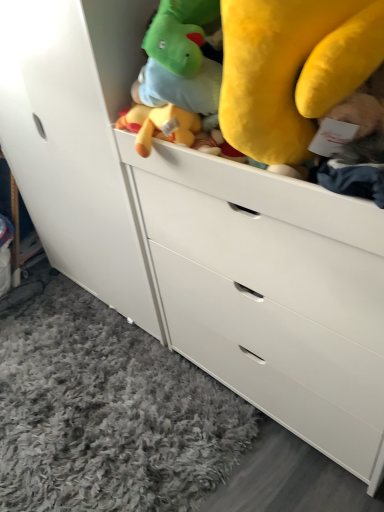
Locate an element on the screen. The height and width of the screenshot is (512, 384). gray shag rug at lower left is located at coordinates (105, 410).

What do you see at coordinates (105, 410) in the screenshot? I see `gray shag rug at lower left` at bounding box center [105, 410].

Image resolution: width=384 pixels, height=512 pixels. Find the location of `white matte cabinet at upper center`. white matte cabinet at upper center is located at coordinates (77, 140).

Measure the distance between white matte cabinet at upper center and camera.

The distance of white matte cabinet at upper center from camera is 39.32 inches.

This screenshot has height=512, width=384. Describe the element at coordinates (77, 140) in the screenshot. I see `white matte cabinet at upper center` at that location.

The image size is (384, 512). Identify the location of gray shag rug at lower left. (105, 410).

From the picture: Between gray shag rug at lower left and white matte cabinet at upper center, which one appears on the right side from the viewer's perspective?

white matte cabinet at upper center is more to the right.

Is gray shag rug at lower left positioned before white matte cabinet at upper center?

No.

Considering the points (118, 412) and (108, 222), which point is behind, point (118, 412) or point (108, 222)?

The point (108, 222) is more distant.

From the image's perspective, relative to white matte cabinet at upper center, is gray shag rug at lower left above or below?

Based on their image positions, gray shag rug at lower left is located beneath white matte cabinet at upper center.

From a real-world perspective, relative to white matte cabinet at upper center, is gray shag rug at lower left vertically above or below?

Answer: In terms of real-world spatial position, gray shag rug at lower left is below white matte cabinet at upper center.

Considering the sizes of objects gray shag rug at lower left and white matte cabinet at upper center in the image provided, who is wider, gray shag rug at lower left or white matte cabinet at upper center?

With larger width is gray shag rug at lower left.

Based on the photo, considering the sizes of objects gray shag rug at lower left and white matte cabinet at upper center in the image provided, who is taller, gray shag rug at lower left or white matte cabinet at upper center?

Standing taller between the two is white matte cabinet at upper center.

Who is bigger, gray shag rug at lower left or white matte cabinet at upper center?

white matte cabinet at upper center.

Is gray shag rug at lower left situated inside white matte cabinet at upper center or outside?

The correct answer is: outside.

Are gray shag rug at lower left and white matte cabinet at upper center located far from each other?

No, gray shag rug at lower left is in close proximity to white matte cabinet at upper center.

Based on the photo, is white matte cabinet at upper center at the back of gray shag rug at lower left?

No, white matte cabinet at upper center is not at the back of gray shag rug at lower left.

Where is `cabinetry that is on the right side of gray shag rug at lower left`? This screenshot has height=512, width=384. cabinetry that is on the right side of gray shag rug at lower left is located at coordinates 77,140.

Considering the positions of objects white matte cabinet at upper center and gray shag rug at lower left in the image provided, who is more to the left, white matte cabinet at upper center or gray shag rug at lower left?

gray shag rug at lower left.

Does white matte cabinet at upper center come behind gray shag rug at lower left?

No, white matte cabinet at upper center is in front of gray shag rug at lower left.

Considering the points (52, 238) and (113, 373), which point is in front, point (52, 238) or point (113, 373)?

The point (113, 373) is more forward.

From the image's perspective, is white matte cabinet at upper center beneath gray shag rug at lower left?

Incorrect, from the image's perspective, white matte cabinet at upper center is higher than gray shag rug at lower left.

From a real-world perspective, is white matte cabinet at upper center on top of gray shag rug at lower left?

Yes, from a real-world perspective, white matte cabinet at upper center is over gray shag rug at lower left

Between white matte cabinet at upper center and gray shag rug at lower left, which one has smaller width?

With smaller width is white matte cabinet at upper center.

Based on the photo, considering the sizes of objects white matte cabinet at upper center and gray shag rug at lower left in the image provided, who is taller, white matte cabinet at upper center or gray shag rug at lower left?

white matte cabinet at upper center.

Looking at this image, who is bigger, white matte cabinet at upper center or gray shag rug at lower left?

Bigger between the two is white matte cabinet at upper center.

Is white matte cabinet at upper center positioned beyond the bounds of gray shag rug at lower left?

Yes, white matte cabinet at upper center is outside of gray shag rug at lower left.

Is white matte cabinet at upper center placed right next to gray shag rug at lower left?

white matte cabinet at upper center and gray shag rug at lower left are clearly separated.

Is white matte cabinet at upper center turned away from gray shag rug at lower left?

white matte cabinet at upper center does not have its back to gray shag rug at lower left.

How different are the orientations of white matte cabinet at upper center and gray shag rug at lower left in degrees?

89.3 degrees separate the facing orientations of white matte cabinet at upper center and gray shag rug at lower left.

Identify the location of plain on the left of white matte cabinet at upper center. This screenshot has height=512, width=384. (105, 410).

The image size is (384, 512). Find the location of `plain that is under the white matte cabinet at upper center (from a real-world perspective)`. plain that is under the white matte cabinet at upper center (from a real-world perspective) is located at coordinates (105, 410).

At what (x,y) coordinates should I click in order to perform the action: click on cabinetry on the right of gray shag rug at lower left. Please return your answer as a coordinate pair (x, y). Looking at the image, I should click on (77, 140).